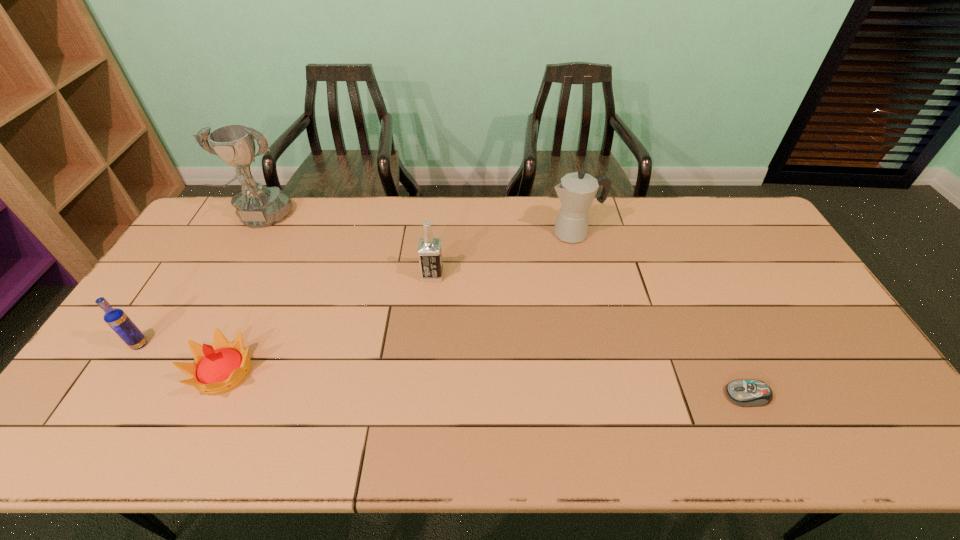
Locate an element on the screen. The width and height of the screenshot is (960, 540). vacant space located on the side with emblem of the award is located at coordinates (240, 259).

The width and height of the screenshot is (960, 540). Find the location of `blank area located on the front of the fifth shortest object`. blank area located on the front of the fifth shortest object is located at coordinates (579, 258).

You are a GUI agent. You are given a task and a screenshot of the screen. Output one action in this format:
    pyautogui.click(x=<x>, y=<y>)
    Task: Click on the free location located 0.260m on the front label of the farther vodka
    
    Given the screenshot: What is the action you would take?
    pyautogui.click(x=527, y=275)

Identify the location of free space located on the back of the left vodka. (171, 296).

Identify the location of free space located 0.050m on the right of the second shortest object. (276, 372).

Find the location of a particular element. The width and height of the screenshot is (960, 540). free space located on the wheel side of the shortest object is located at coordinates (619, 395).

I want to click on free space located on the wheel side of the shortest object, so click(x=681, y=395).

Locate an element on the screen. vacant space positioned 0.280m on the wheel side of the shortest object is located at coordinates (612, 395).

You are a GUI agent. You are given a task and a screenshot of the screen. Output one action in this format:
    pyautogui.click(x=<x>, y=<y>)
    Task: Click on the award that is at the far edge
    
    Given the screenshot: What is the action you would take?
    pyautogui.click(x=257, y=206)

Find the location of a particular element. The image size is (960, 540). coffeepot that is at the far edge is located at coordinates (577, 190).